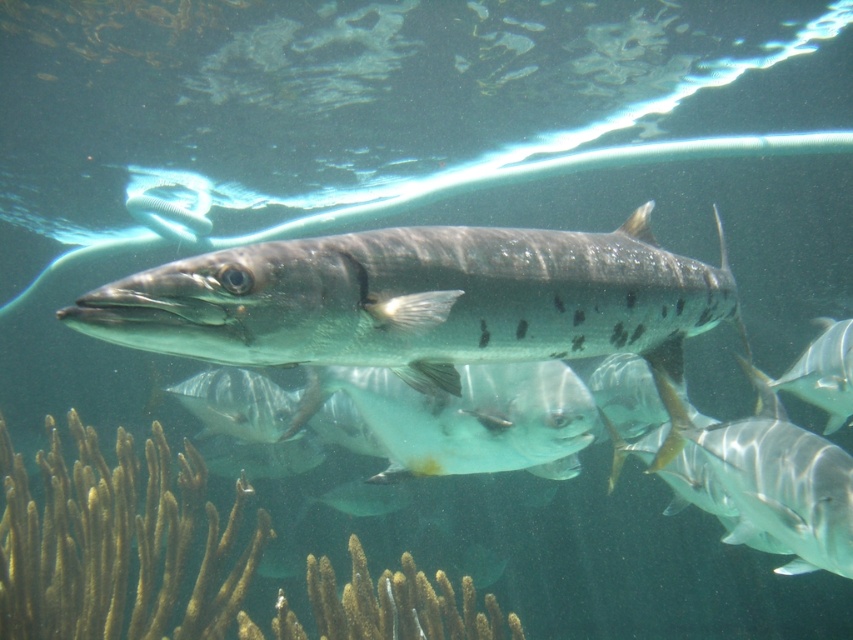
Is shiny silver fish at center wider than brown textured coral at lower left?

Incorrect, shiny silver fish at center's width does not surpass brown textured coral at lower left's.

Is shiny silver fish at center behind brown textured coral at lower left?

No, shiny silver fish at center is in front of brown textured coral at lower left.

Between point (224, 305) and point (157, 548), which one is positioned in front?

Point (224, 305) is more forward.

I want to click on shiny silver fish at center, so click(421, 300).

Which is below, shiny silver fish at center or translucent silver fish at center?

translucent silver fish at center is lower down.

Does shiny silver fish at center appear on the left side of translucent silver fish at center?

In fact, shiny silver fish at center is to the right of translucent silver fish at center.

Who is more distant from viewer, (315, 353) or (428, 428)?

The point (428, 428) is behind.

Locate an element on the screen. The height and width of the screenshot is (640, 853). shiny silver fish at center is located at coordinates click(x=421, y=300).

Is the position of brown textured coral at lower left less distant than that of translucent silver fish at center?

No, brown textured coral at lower left is behind translucent silver fish at center.

Is brown textured coral at lower left further to the viewer compared to translucent silver fish at center?

Yes, it is.

Who is more forward, (4, 579) or (512, 364)?

Point (512, 364)

Locate an element on the screen. Image resolution: width=853 pixels, height=640 pixels. brown textured coral at lower left is located at coordinates (94, 538).